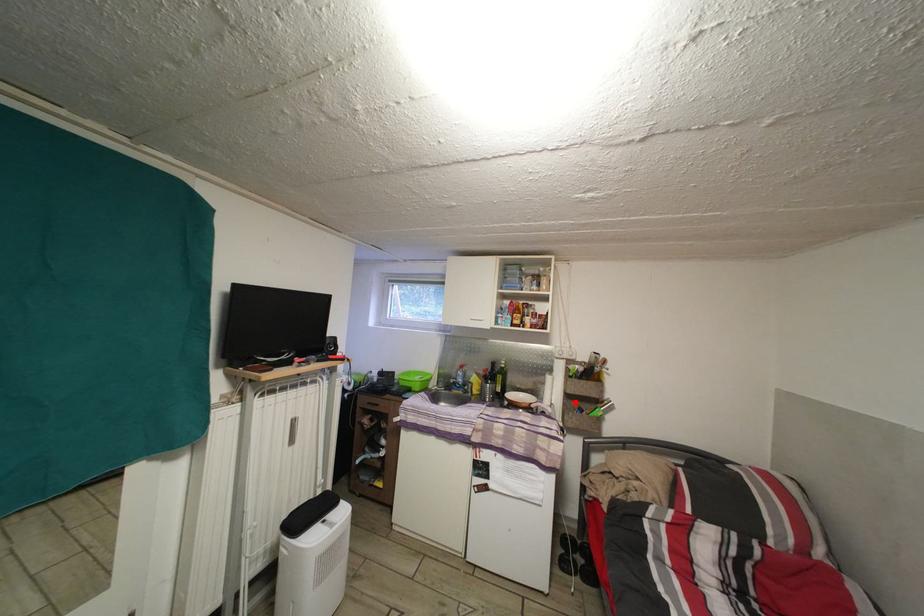
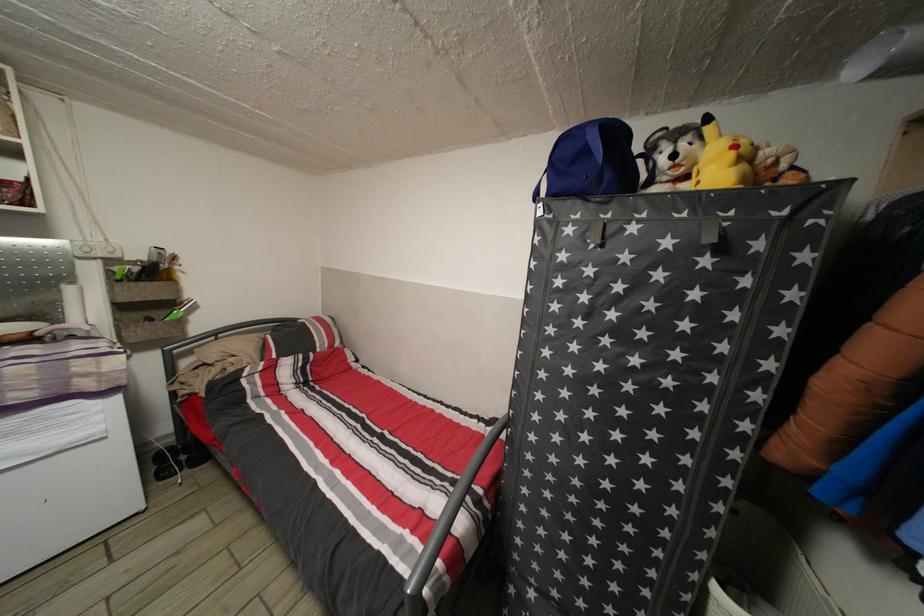
Question: I am providing you with two images of the same scene from different viewpoints. In image1, a red point is highlighted. Considering the same 3D point in image2, which of the following is correct?

Choices:
 (A) It is closer
 (B) It is farther

Answer: (A)